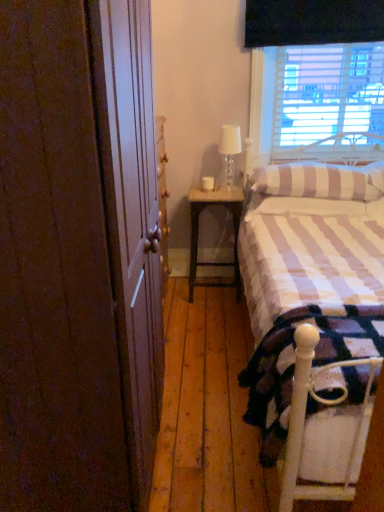
The image size is (384, 512). Find the location of `blank space to the left of translucent glass table lamp at upper right`. blank space to the left of translucent glass table lamp at upper right is located at coordinates (211, 187).